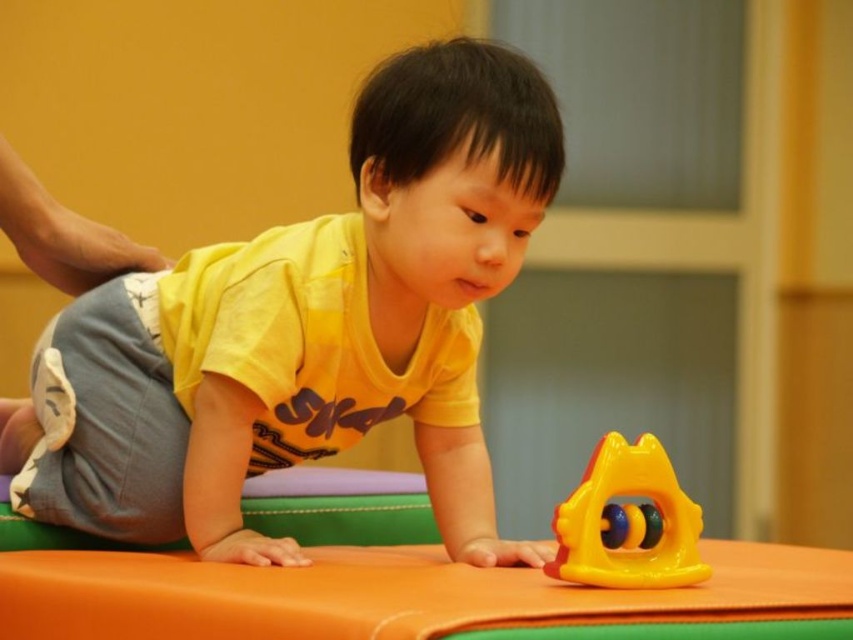
Question: Among these objects, which one is farthest from the camera?

Choices:
 (A) yellow matte shirt at center
 (B) rubberized yellow and orange toy at center

Answer: (A)

Question: Can you confirm if yellow matte shirt at center is positioned below rubberized yellow and orange toy at center?

Choices:
 (A) no
 (B) yes

Answer: (A)

Question: Where is yellow matte shirt at center located in relation to rubberized yellow and orange toy at center in the image?

Choices:
 (A) left
 (B) right

Answer: (A)

Question: Is yellow matte shirt at center positioned behind rubberized yellow and orange toy at center?

Choices:
 (A) no
 (B) yes

Answer: (B)

Question: Among these objects, which one is farthest from the camera?

Choices:
 (A) yellow matte shirt at center
 (B) rubberized yellow and orange toy at center

Answer: (A)